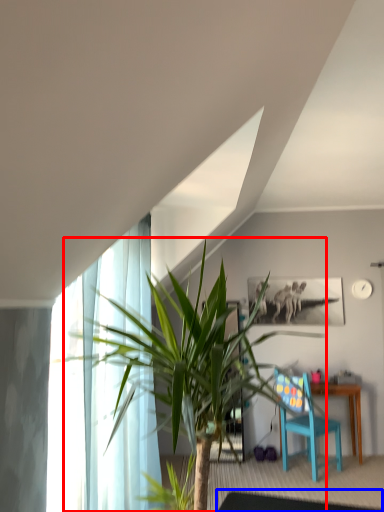
Question: Which object is closer to the camera taking this photo, houseplant (highlighted by a red box) or glass table (highlighted by a blue box)?

Choices:
 (A) houseplant
 (B) glass table

Answer: (A)